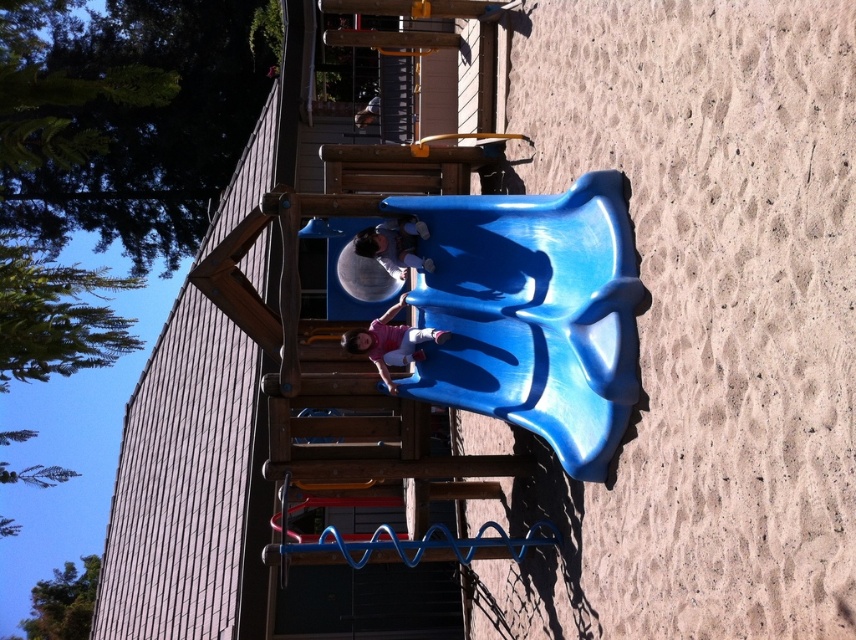
Question: Does matte pink shirt at center have a smaller size compared to matte blue slide at center?

Choices:
 (A) yes
 (B) no

Answer: (B)

Question: From the image, what is the correct spatial relationship of matte pink shirt at center in relation to matte blue slide at center?

Choices:
 (A) left
 (B) right

Answer: (B)

Question: Which point is closer to the camera?

Choices:
 (A) matte black helmet at upper center
 (B) matte blue slide at center
 (C) blue plastic slide at center
 (D) matte pink shirt at center

Answer: (C)

Question: Does blue plastic slide at center appear over matte blue slide at center?

Choices:
 (A) no
 (B) yes

Answer: (A)

Question: Which is farther from the matte blue slide at center?

Choices:
 (A) blue plastic slide at center
 (B) matte black helmet at upper center
 (C) matte pink shirt at center

Answer: (B)

Question: Which object is positioned closest to the blue plastic slide at center?

Choices:
 (A) matte pink shirt at center
 (B) matte blue slide at center

Answer: (B)